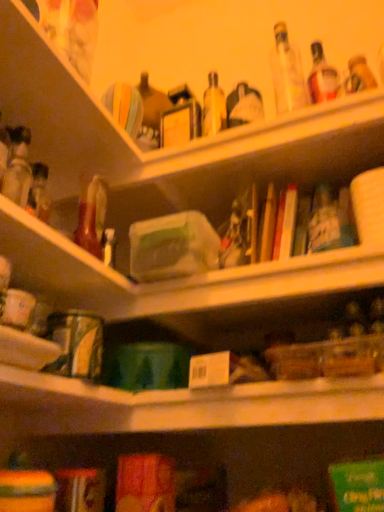
Question: From their relative heights in the image, would you say matte plastic bag at upper left is taller or shorter than translucent glass bottle at left?

Choices:
 (A) short
 (B) tall

Answer: (B)

Question: From the image's perspective, is matte plastic bag at upper left positioned above or below translucent glass bottle at left?

Choices:
 (A) below
 (B) above

Answer: (B)

Question: In the image, is matte plastic bag at upper left on the left side or the right side of translucent glass bottle at left?

Choices:
 (A) left
 (B) right

Answer: (B)

Question: Choose the correct answer: Is translucent glass bottle at left inside matte plastic bag at upper left or outside it?

Choices:
 (A) inside
 (B) outside

Answer: (B)

Question: Is translucent glass bottle at left bigger or smaller than matte plastic bag at upper left?

Choices:
 (A) big
 (B) small

Answer: (B)

Question: Is translucent glass bottle at left taller or shorter than matte plastic bag at upper left?

Choices:
 (A) short
 (B) tall

Answer: (A)

Question: In the image, is translucent glass bottle at left on the left side or the right side of matte plastic bag at upper left?

Choices:
 (A) right
 (B) left

Answer: (B)